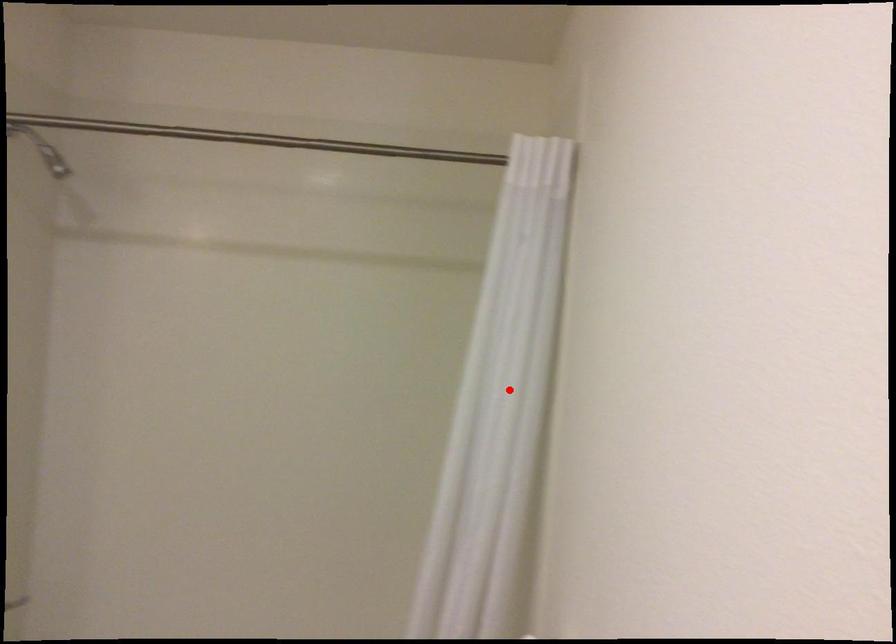
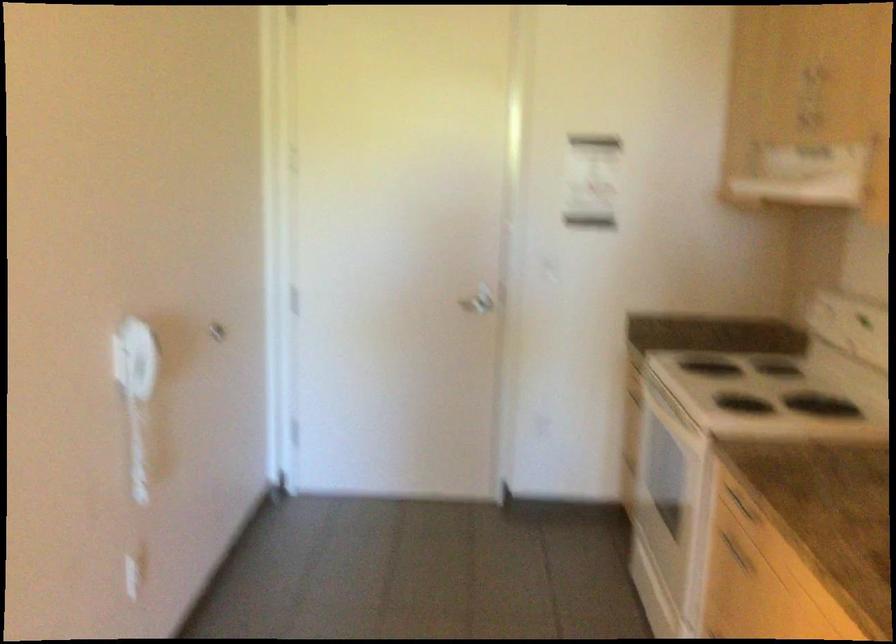
Question: I am providing you with two images of the same scene from different viewpoints. A red point is marked on the first image. Can you still see the location of the red point in image 2?

Choices:
 (A) Yes
 (B) No

Answer: (B)